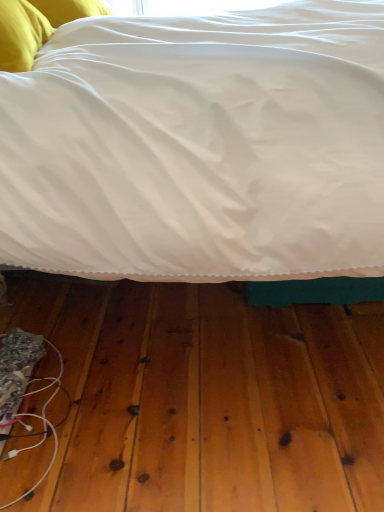
Question: Would you say white fabric wire at lower left is to the left or to the right of white satin bed at center in the picture?

Choices:
 (A) left
 (B) right

Answer: (A)

Question: From a real-world perspective, is white fabric wire at lower left above or below white satin bed at center?

Choices:
 (A) below
 (B) above

Answer: (A)

Question: Which of these objects is positioned closest to the yellow fabric pillow at upper left?

Choices:
 (A) white fabric wire at lower left
 (B) white satin bed at center

Answer: (B)

Question: Considering the real-world distances, which object is closest to the yellow fabric pillow at upper left?

Choices:
 (A) white fabric wire at lower left
 (B) white satin bed at center

Answer: (B)